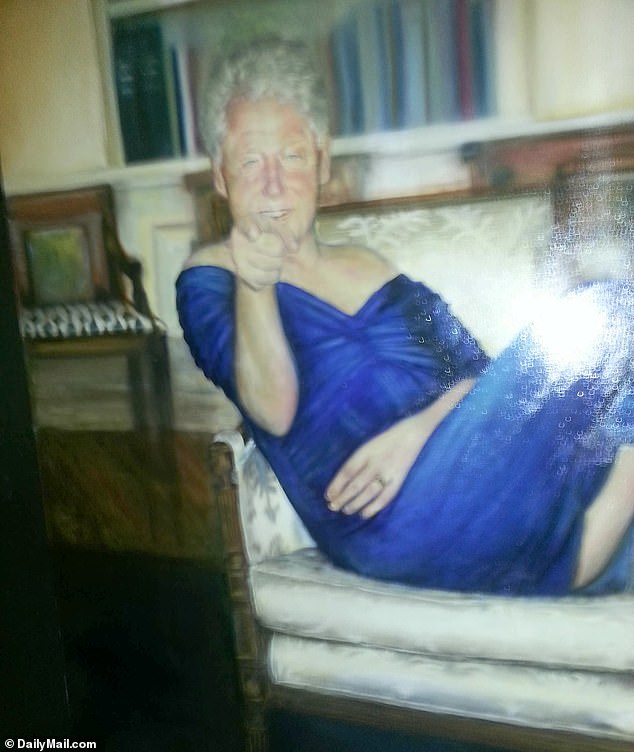
The image size is (634, 752). In order to click on sofa in this screenshot , I will do `click(439, 225)`.